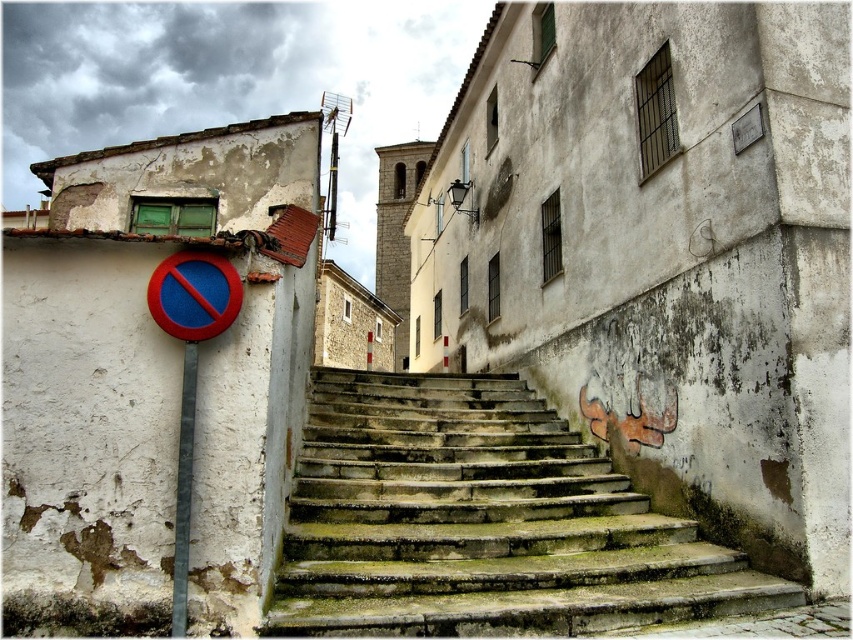
Between green mossy concrete stairs at center and gray metallic pole at left, which one has less height?

With less height is green mossy concrete stairs at center.

Can you confirm if green mossy concrete stairs at center is positioned to the right of gray metallic pole at left?

Indeed, green mossy concrete stairs at center is positioned on the right side of gray metallic pole at left.

Where is `green mossy concrete stairs at center`? The image size is (853, 640). green mossy concrete stairs at center is located at coordinates click(x=482, y=522).